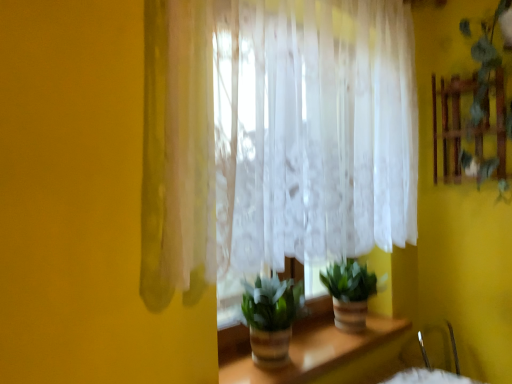
Question: From the image's perspective, is green matte plant at center, which is counted as the second houseplant, starting from the left, on top of translucent glass vase at center?

Choices:
 (A) no
 (B) yes

Answer: (B)

Question: Can you confirm if green matte plant at center, placed as the 1th houseplant when sorted from back to front, is wider than translucent glass vase at center?

Choices:
 (A) no
 (B) yes

Answer: (A)

Question: From the image's perspective, would you say green matte plant at center, which is counted as the second houseplant, starting from the left, is shown under translucent glass vase at center?

Choices:
 (A) no
 (B) yes

Answer: (A)

Question: Considering the relative sizes of green matte plant at center, which is counted as the second houseplant, starting from the left, and translucent glass vase at center in the image provided, is green matte plant at center, which is counted as the second houseplant, starting from the left, shorter than translucent glass vase at center?

Choices:
 (A) no
 (B) yes

Answer: (A)

Question: Can you confirm if green matte plant at center, placed as the 2th houseplant when sorted from front to back, is taller than translucent glass vase at center?

Choices:
 (A) yes
 (B) no

Answer: (A)

Question: Can you confirm if green matte plant at center, placed as the 1th houseplant when sorted from back to front, is smaller than translucent glass vase at center?

Choices:
 (A) no
 (B) yes

Answer: (A)

Question: Is translucent glass vase at center next to green matte plant at center, the first houseplant positioned from the front, and touching it?

Choices:
 (A) no
 (B) yes

Answer: (A)

Question: Can you confirm if translucent glass vase at center is bigger than green matte plant at center, which is counted as the first houseplant, starting from the left?

Choices:
 (A) no
 (B) yes

Answer: (A)

Question: Does translucent glass vase at center come behind green matte plant at center, which ranks as the 2th houseplant in back-to-front order?

Choices:
 (A) no
 (B) yes

Answer: (A)

Question: Is green matte plant at center, which is counted as the first houseplant, starting from the left, a part of translucent glass vase at center?

Choices:
 (A) yes
 (B) no

Answer: (B)

Question: Can you confirm if translucent glass vase at center is smaller than green matte plant at center, which ranks as the 2th houseplant in back-to-front order?

Choices:
 (A) no
 (B) yes

Answer: (B)

Question: Is translucent glass vase at center positioned with its back to green matte plant at center, which is counted as the first houseplant, starting from the left?

Choices:
 (A) yes
 (B) no

Answer: (B)

Question: Does green matte plant at center, placed as the 1th houseplant when sorted from back to front, have a lesser height compared to green leafy plant at upper right?

Choices:
 (A) no
 (B) yes

Answer: (B)